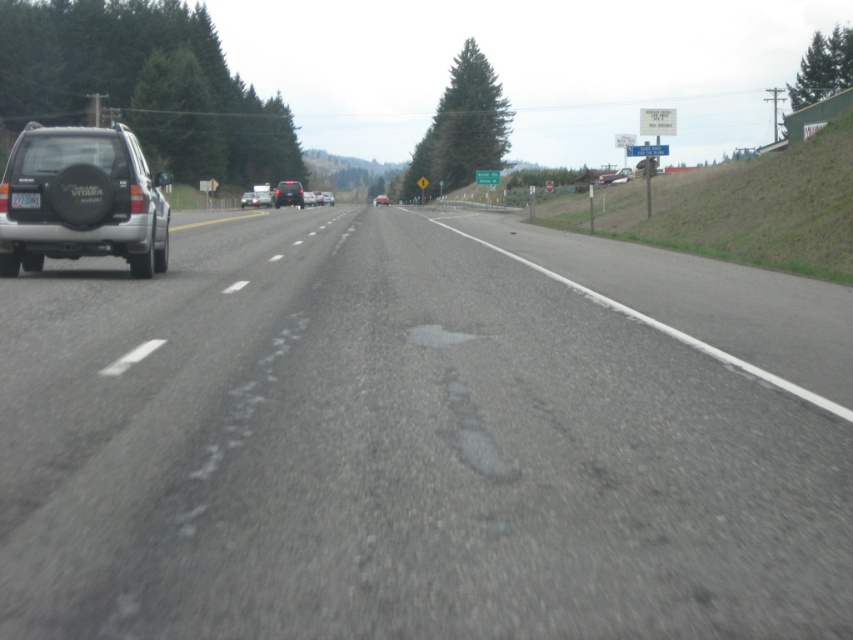
Question: Considering the real-world distances, which object is farthest from the silver matte suv at left?

Choices:
 (A) gray asphalt road at center
 (B) silver metallic sedan at center
 (C) shiny black suv at center
 (D) black plastic license plate at left

Answer: (B)

Question: Does silver metallic sedan at center come behind matte black car at center?

Choices:
 (A) no
 (B) yes

Answer: (A)

Question: Which of these objects is positioned farthest from the matte black car at center?

Choices:
 (A) shiny black suv at center
 (B) black plastic license plate at left

Answer: (B)

Question: Does silver metallic sedan at center appear under matte black car at center?

Choices:
 (A) no
 (B) yes

Answer: (B)

Question: Which of these objects is positioned farthest from the silver metallic sedan at center?

Choices:
 (A) silver matte suv at left
 (B) shiny black suv at center
 (C) black plastic license plate at left
 (D) gray asphalt road at center

Answer: (C)

Question: Can you confirm if black plastic license plate at left is positioned to the right of silver metallic sedan at center?

Choices:
 (A) no
 (B) yes

Answer: (B)